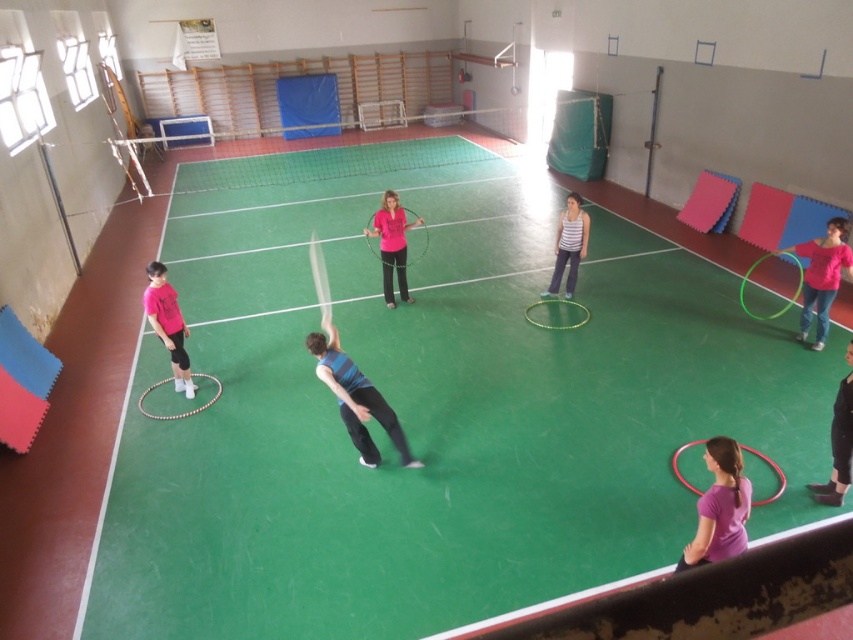
Can you confirm if blue striped shirt at center is positioned to the right of striped fabric hula hoop at center?

Incorrect, blue striped shirt at center is not on the right side of striped fabric hula hoop at center.

In the scene shown: Between blue striped shirt at center and striped fabric hula hoop at center, which one is positioned lower?

Positioned lower is blue striped shirt at center.

Does point (349, 432) lie in front of point (566, 241)?

Yes, it is.

Find the location of a particular element. The height and width of the screenshot is (640, 853). blue striped shirt at center is located at coordinates (355, 396).

Does blue striped shirt at center appear under pink fabric hula hoop at right?

Indeed, blue striped shirt at center is positioned under pink fabric hula hoop at right.

Can you confirm if blue striped shirt at center is shorter than pink fabric hula hoop at right?

Yes, blue striped shirt at center is shorter than pink fabric hula hoop at right.

Between point (386, 412) and point (827, 252), which one is positioned behind?

Positioned behind is point (827, 252).

The image size is (853, 640). I want to click on blue striped shirt at center, so click(x=355, y=396).

Which of these two, purple matte hula hoop at lower right or pink matte hula hoop at center, stands taller?

pink matte hula hoop at center

Can you confirm if purple matte hula hoop at lower right is positioned above pink matte hula hoop at center?

Incorrect, purple matte hula hoop at lower right is not positioned above pink matte hula hoop at center.

At what (x,y) coordinates should I click in order to perform the action: click on purple matte hula hoop at lower right. Please return your answer as a coordinate pair (x, y). Looking at the image, I should click on (720, 508).

Locate an element on the screen. purple matte hula hoop at lower right is located at coordinates (720, 508).